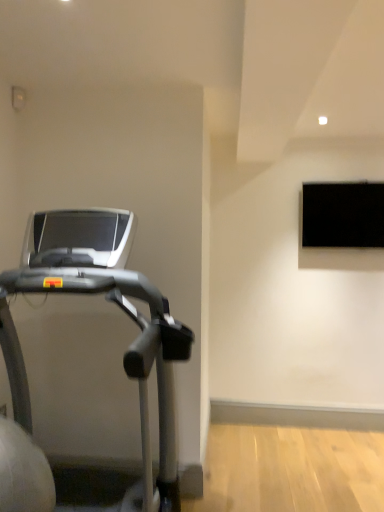
This screenshot has height=512, width=384. In order to click on blank area beneath black matte tv at upper right (from a real-world perspective) in this screenshot , I will do `click(348, 425)`.